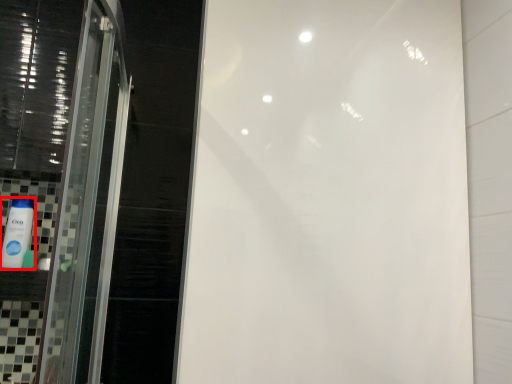
Question: Considering the relative positions of mouthwash (annotated by the red box) and toiletry in the image provided, where is mouthwash (annotated by the red box) located with respect to the staircase?

Choices:
 (A) left
 (B) right

Answer: (A)